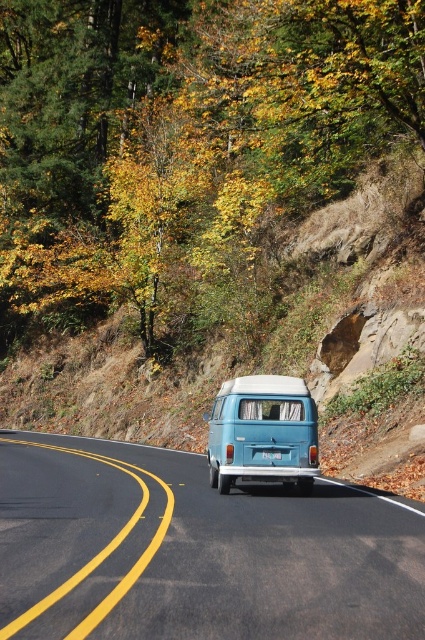
You are a passenger in the vintage blue Volkswagen van and want to know which of the two points, point [105,448] or point [237,384], is closer to you. Which one is closer?

Point [105,448] is further to the viewer than point [237,384], so the closer point to you is point [237,384].

You are a passenger in the vintage blue Volkswagen van and notice two points on the road ahead. The first point is at coordinates point (67,328) and the second is at point (175,586). Which point is closer to the van as it travels forward?

Point (175,586) is closer to the van because it is less further to the camera than point (67,328).